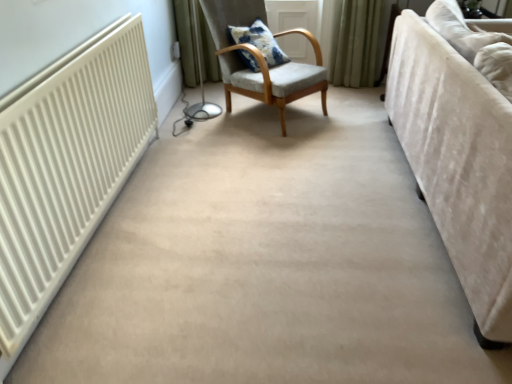
Question: Should I look upward or downward to see light gray fabric chair at center?

Choices:
 (A) down
 (B) up

Answer: (B)

Question: From a real-world perspective, is light gray fabric chair at center located higher than blue printed cushion at center?

Choices:
 (A) no
 (B) yes

Answer: (A)

Question: Is light gray fabric chair at center located outside blue printed cushion at center?

Choices:
 (A) yes
 (B) no

Answer: (A)

Question: Does light gray fabric chair at center have a lesser height compared to blue printed cushion at center?

Choices:
 (A) yes
 (B) no

Answer: (B)

Question: Can you confirm if light gray fabric chair at center is taller than blue printed cushion at center?

Choices:
 (A) yes
 (B) no

Answer: (A)

Question: Is light gray fabric chair at center smaller than blue printed cushion at center?

Choices:
 (A) yes
 (B) no

Answer: (B)

Question: Is light gray fabric chair at center turned away from blue printed cushion at center?

Choices:
 (A) yes
 (B) no

Answer: (A)

Question: Does velvet beige couch at right have a larger size compared to light gray fabric chair at center?

Choices:
 (A) yes
 (B) no

Answer: (A)

Question: From the image's perspective, is velvet beige couch at right located beneath light gray fabric chair at center?

Choices:
 (A) no
 (B) yes

Answer: (B)

Question: Does velvet beige couch at right appear on the left side of light gray fabric chair at center?

Choices:
 (A) no
 (B) yes

Answer: (A)

Question: Is light gray fabric chair at center a part of velvet beige couch at right?

Choices:
 (A) no
 (B) yes

Answer: (A)

Question: Does velvet beige couch at right appear on the right side of light gray fabric chair at center?

Choices:
 (A) no
 (B) yes

Answer: (B)

Question: Considering the relative sizes of velvet beige couch at right and light gray fabric chair at center in the image provided, is velvet beige couch at right shorter than light gray fabric chair at center?

Choices:
 (A) no
 (B) yes

Answer: (B)

Question: Considering the relative positions of light gray fabric chair at center and velvet beige couch at right in the image provided, is light gray fabric chair at center to the left of velvet beige couch at right from the viewer's perspective?

Choices:
 (A) yes
 (B) no

Answer: (A)